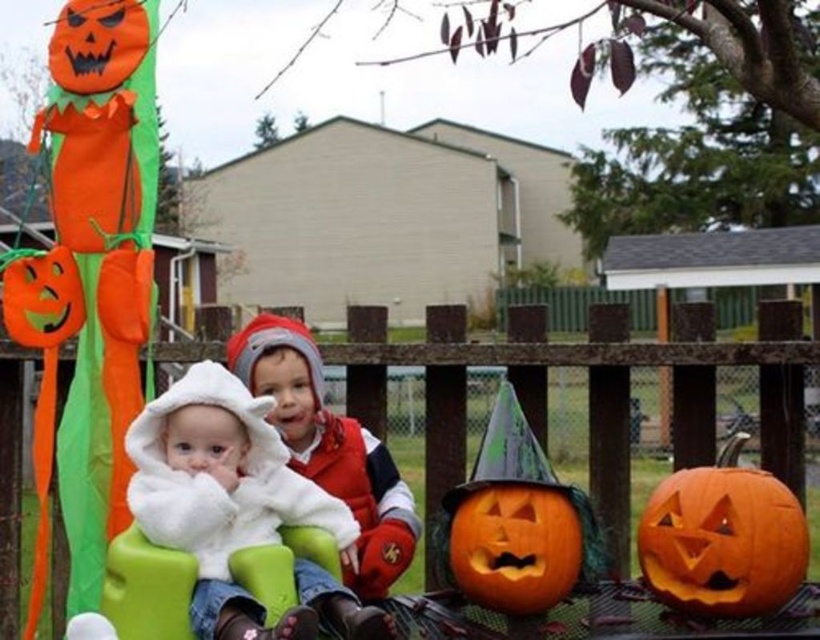
You are a parent trying to dress your child for Halloween. You have a white fluffy coat at center and a white fleece hat at center. Based on the scene described, which item should you put on first to ensure proper layering?

The white fluffy coat at center should be put on first because the white fleece hat at center is above it, indicating the coat is worn underneath.

You are a parent trying to dress your child for Halloween. You have a white fluffy coat at center and a white fleece hat at center. Which item should you put on first according to the size difference mentioned?

The white fluffy coat at center is smaller than the white fleece hat at center, so you should put on the white fluffy coat at center first since it is smaller and likely goes under the larger hat.